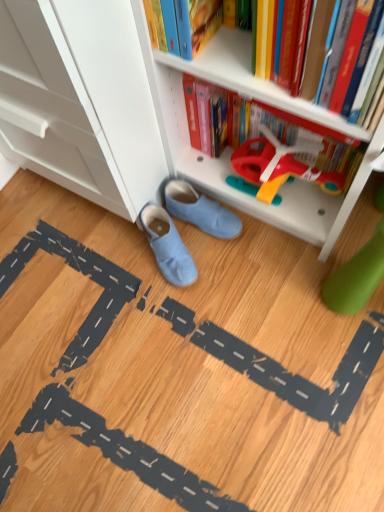
Question: From a real-world perspective, is suede-like blue slippers at center, the first footwear when ordered from top to bottom, positioned under hardcover book at upper center based on gravity?

Choices:
 (A) no
 (B) yes

Answer: (B)

Question: Can you confirm if suede-like blue slippers at center, the 2th footwear in the bottom-to-top sequence, is shorter than hardcover book at upper center?

Choices:
 (A) no
 (B) yes

Answer: (B)

Question: Does suede-like blue slippers at center, the 2th footwear in the bottom-to-top sequence, have a smaller size compared to hardcover book at upper center?

Choices:
 (A) no
 (B) yes

Answer: (B)

Question: Does suede-like blue slippers at center, the 2th footwear in the bottom-to-top sequence, touch hardcover book at upper center?

Choices:
 (A) yes
 (B) no

Answer: (B)

Question: Considering the relative sizes of suede-like blue slippers at center, the 2th footwear in the bottom-to-top sequence, and hardcover book at upper center in the image provided, is suede-like blue slippers at center, the 2th footwear in the bottom-to-top sequence, thinner than hardcover book at upper center?

Choices:
 (A) no
 (B) yes

Answer: (A)

Question: Can you confirm if suede-like blue slippers at center, the first footwear when ordered from top to bottom, is positioned to the right of hardcover book at upper center?

Choices:
 (A) no
 (B) yes

Answer: (A)

Question: Is light blue suede shoes at center, which ranks as the 1th footwear in bottom-to-top order, bigger than white plastic bookcase at lower center?

Choices:
 (A) yes
 (B) no

Answer: (B)

Question: Is light blue suede shoes at center, which ranks as the 1th footwear in bottom-to-top order, further to the viewer compared to white plastic bookcase at lower center?

Choices:
 (A) yes
 (B) no

Answer: (A)

Question: Does light blue suede shoes at center, which ranks as the 1th footwear in bottom-to-top order, contain white plastic bookcase at lower center?

Choices:
 (A) no
 (B) yes

Answer: (A)

Question: Considering the relative sizes of light blue suede shoes at center, which appears as the second footwear when viewed from the top, and white plastic bookcase at lower center in the image provided, is light blue suede shoes at center, which appears as the second footwear when viewed from the top, shorter than white plastic bookcase at lower center?

Choices:
 (A) no
 (B) yes

Answer: (B)

Question: Can you confirm if light blue suede shoes at center, which appears as the second footwear when viewed from the top, is thinner than white plastic bookcase at lower center?

Choices:
 (A) yes
 (B) no

Answer: (A)

Question: Are light blue suede shoes at center, which appears as the second footwear when viewed from the top, and white plastic bookcase at lower center beside each other?

Choices:
 (A) yes
 (B) no

Answer: (B)

Question: Can you confirm if white plastic bookcase at lower center is wider than light blue suede shoes at center, which ranks as the 1th footwear in bottom-to-top order?

Choices:
 (A) no
 (B) yes

Answer: (B)